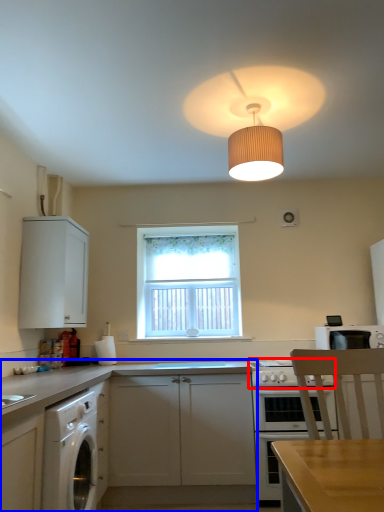
Question: Which object appears farthest to the camera in this image, gas stove (highlighted by a red box) or cabinetry (highlighted by a blue box)?

Choices:
 (A) gas stove
 (B) cabinetry

Answer: (A)